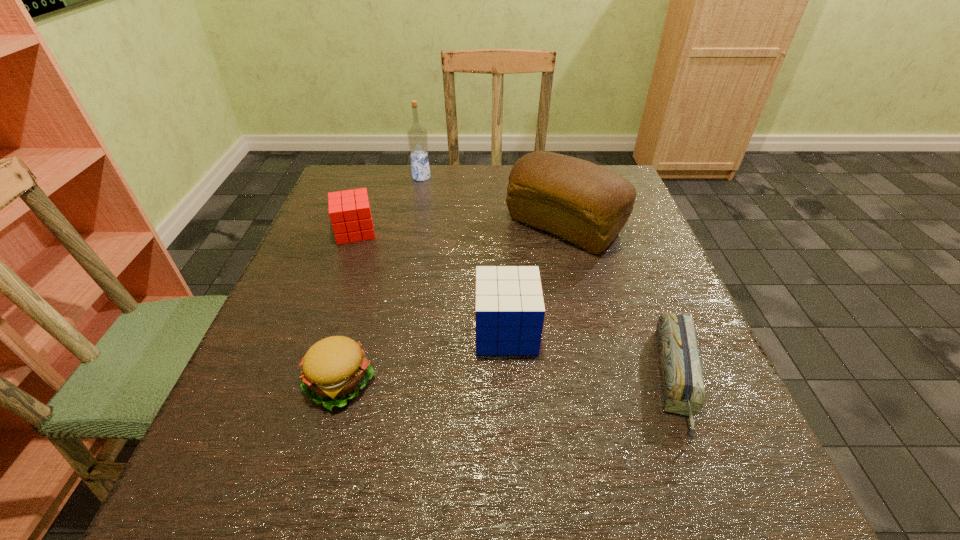
Identify the location of the tallest object. The height and width of the screenshot is (540, 960). (417, 136).

Where is `the farthest object`? This screenshot has height=540, width=960. the farthest object is located at coordinates (417, 136).

Where is `bread`? bread is located at coordinates (588, 205).

Find the location of a particular element. The image size is (960, 540). the taller cube is located at coordinates (509, 307).

Locate an element on the screen. The image size is (960, 540). the nearer cube is located at coordinates click(x=509, y=307).

Find the location of a particular element. This screenshot has width=960, height=540. the left cube is located at coordinates pos(350,215).

Where is `the shorter cube`? This screenshot has width=960, height=540. the shorter cube is located at coordinates coord(350,215).

Find the location of `hamburger`. hamburger is located at coordinates (334, 369).

Image resolution: width=960 pixels, height=540 pixels. Find the location of `pencil box`. pencil box is located at coordinates (683, 390).

The height and width of the screenshot is (540, 960). Find the location of `free space located on the front of the farthest object`. free space located on the front of the farthest object is located at coordinates (415, 212).